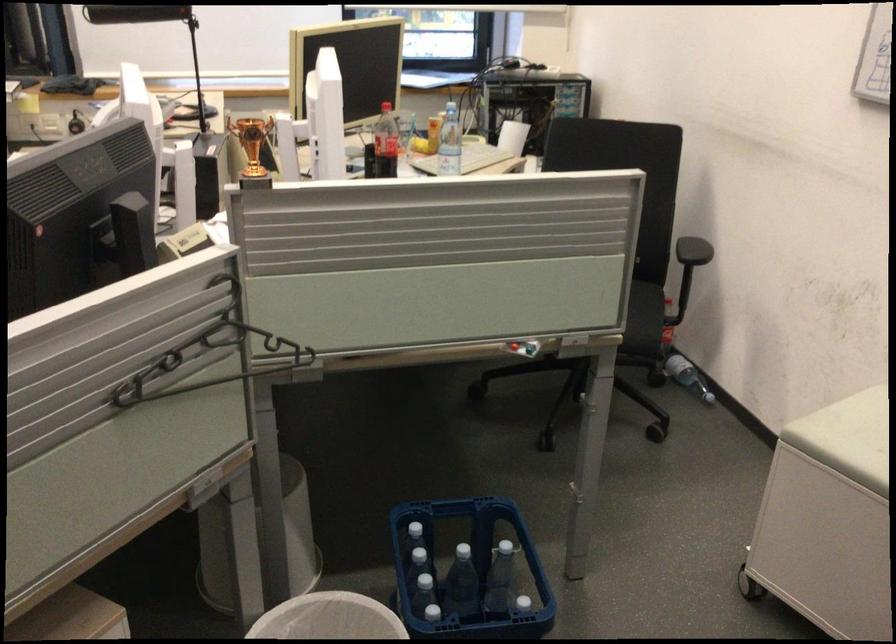
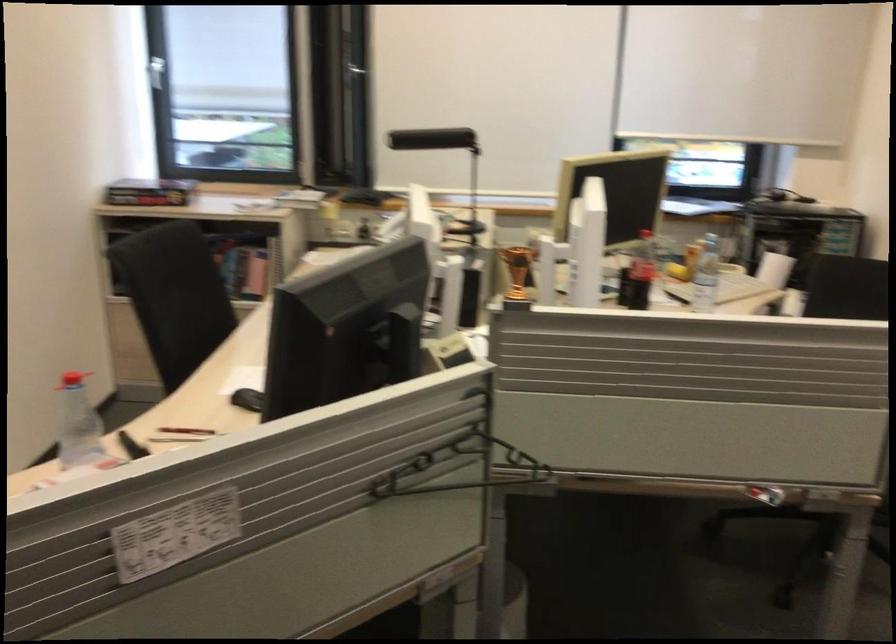
Question: The images are taken continuously from a first-person perspective. In which direction are you moving?

Choices:
 (A) Left
 (B) Right
 (C) Forward
 (D) Backward

Answer: (D)